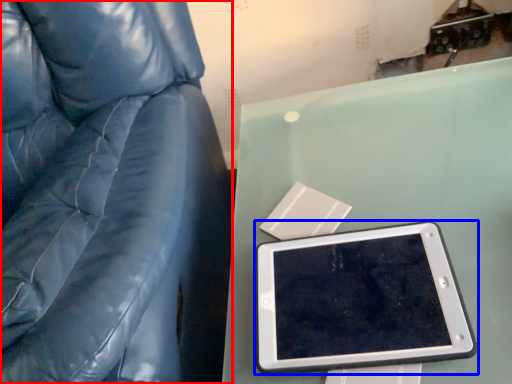
Question: Which object appears closest to the camera in this image, furniture (highlighted by a red box) or tablet computer (highlighted by a blue box)?

Choices:
 (A) furniture
 (B) tablet computer

Answer: (A)